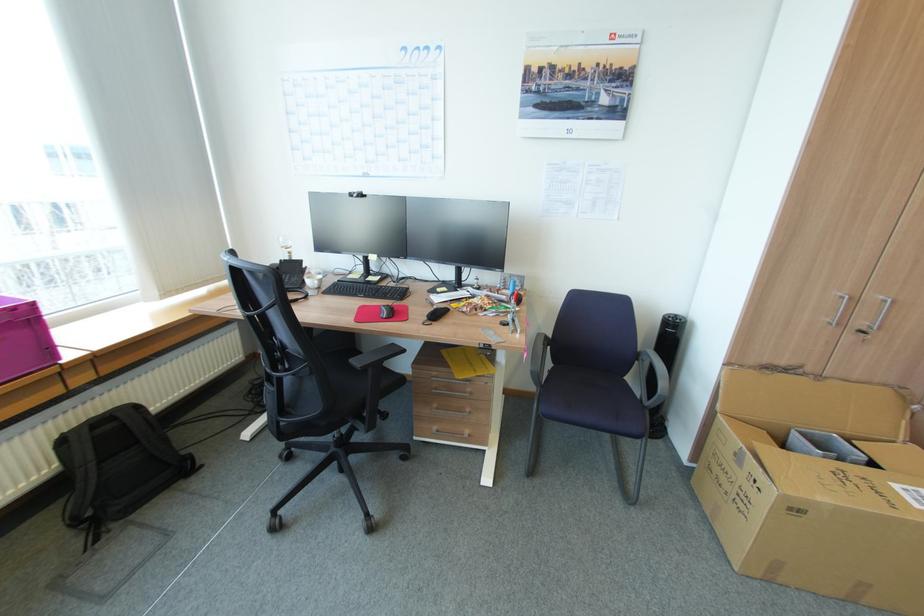
You are a GUI agent. You are given a task and a screenshot of the screen. Output one action in this format:
    pyautogui.click(x=<x>, y=<y>)
    Task: Click on the telephone handset
    
    Given the screenshot: What is the action you would take?
    pyautogui.click(x=435, y=314)